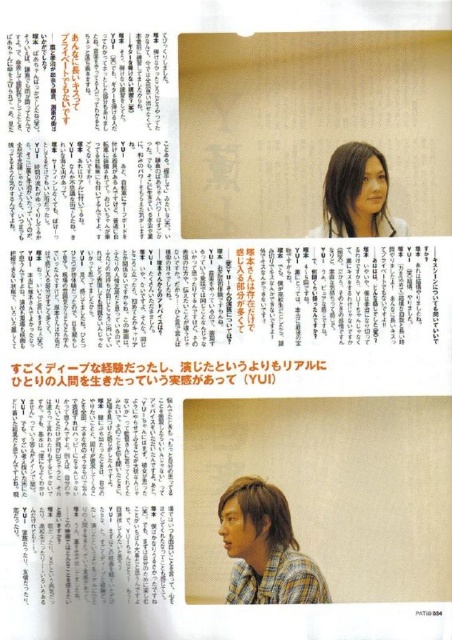
Question: Among these objects, which one is nearest to the camera?

Choices:
 (A) yellow papertexturedpaper at upper center
 (B) checkered fabric shirt at center
 (C) smooth brown hair at upper center
 (D) plaid cotton shirt at lower right

Answer: (B)

Question: Can you confirm if checkered fabric shirt at center is smaller than smooth brown hair at upper center?

Choices:
 (A) yes
 (B) no

Answer: (B)

Question: Does yellow papertexturedpaper at upper center appear over smooth brown hair at upper center?

Choices:
 (A) no
 (B) yes

Answer: (A)

Question: Which point is farther to the camera?

Choices:
 (A) yellow papertexturedpaper at upper center
 (B) smooth brown hair at upper center
 (C) checkered fabric shirt at center
 (D) plaid cotton shirt at lower right

Answer: (B)

Question: Considering the real-world distances, which object is farthest from the checkered fabric shirt at center?

Choices:
 (A) smooth brown hair at upper center
 (B) yellow papertexturedpaper at upper center
 (C) plaid cotton shirt at lower right

Answer: (A)

Question: Can you confirm if checkered fabric shirt at center is positioned to the left of yellow papertexturedpaper at upper center?

Choices:
 (A) yes
 (B) no

Answer: (B)